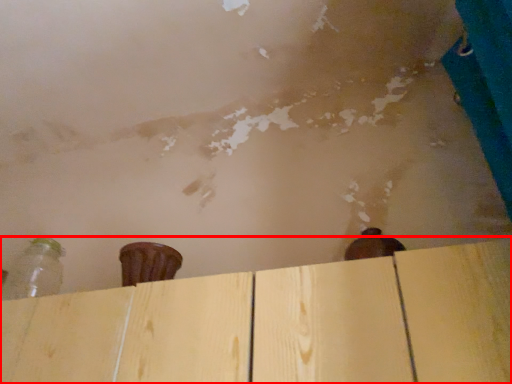
Question: From the image, what is the correct spatial relationship of plywood (annotated by the red box) in relation to bottle?

Choices:
 (A) left
 (B) right

Answer: (B)